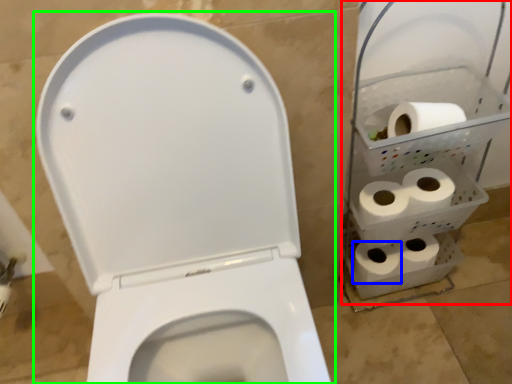
Question: Which is farther away from shelf (highlighted by a red box)? toilet paper (highlighted by a blue box) or toilet paper (highlighted by a green box)?

Choices:
 (A) toilet paper
 (B) toilet paper

Answer: (B)